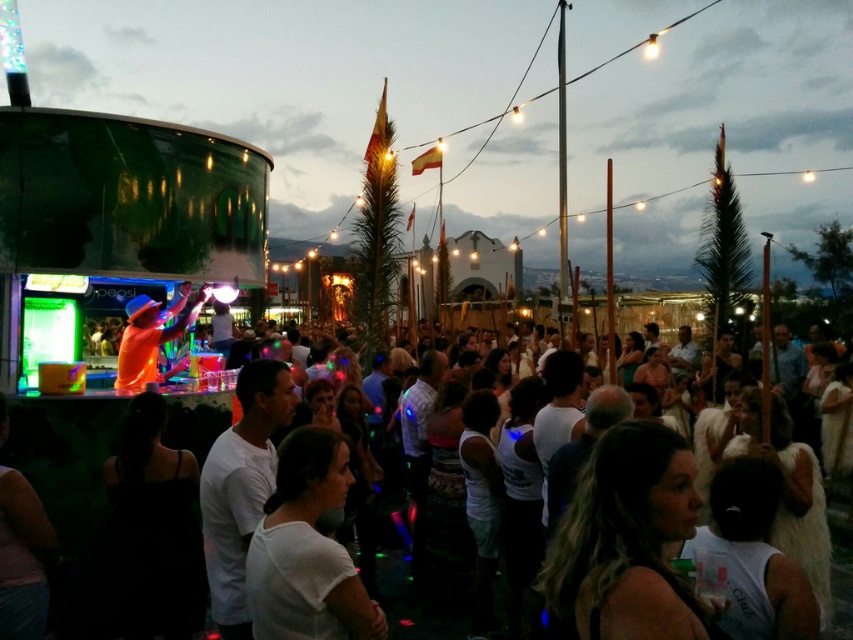
Question: Among these points, which one is nearest to the camera?

Choices:
 (A) (207, 296)
 (B) (844, 540)
 (C) (318, 611)

Answer: (C)

Question: Is white matte shirt at center further to camera compared to orange fabric dj at center?

Choices:
 (A) no
 (B) yes

Answer: (A)

Question: Where is white matte crowd at center located in relation to orange fabric dj at center in the image?

Choices:
 (A) above
 (B) below

Answer: (B)

Question: Which point appears farthest from the camera in this image?

Choices:
 (A) (299, 579)
 (B) (187, 323)

Answer: (B)

Question: Is white matte crowd at center behind orange fabric dj at center?

Choices:
 (A) yes
 (B) no

Answer: (B)

Question: Which of these objects is positioned farthest from the white matte shirt at center?

Choices:
 (A) white matte crowd at center
 (B) orange fabric dj at center

Answer: (B)